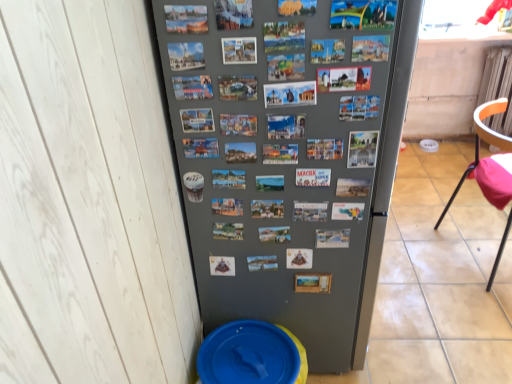
What are the coordinates of `vacant region to the left of orange plastic chair at right` in the screenshot? It's located at point(424,272).